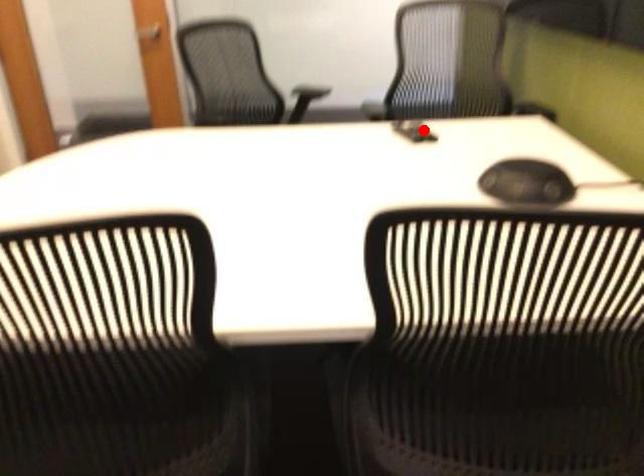
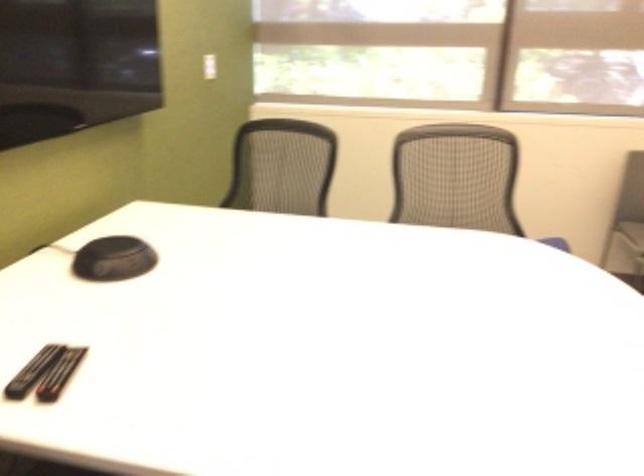
In the second image, find the point that corresponds to the highlighted location in the first image.

(32, 371)